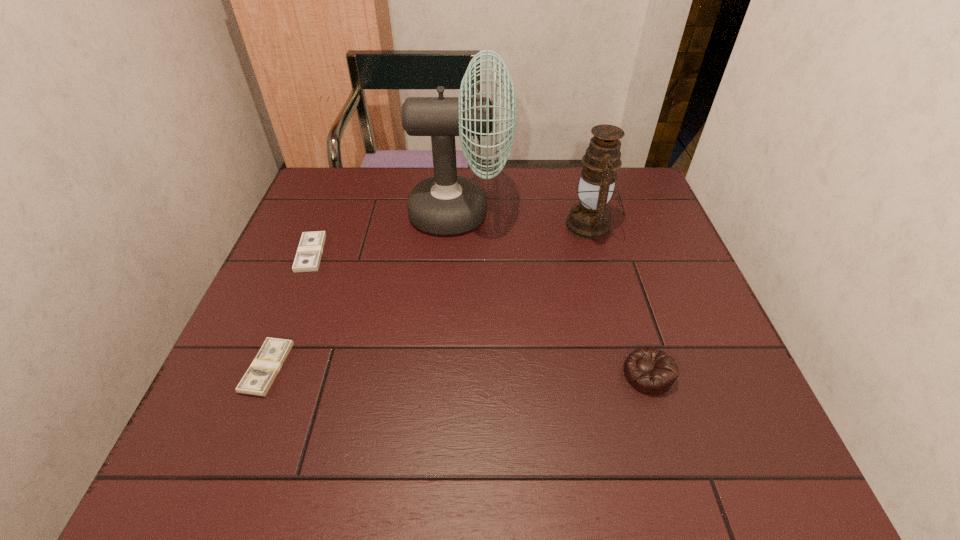
The image size is (960, 540). Find the location of `free point between the nearer dollar and the beanbag`. free point between the nearer dollar and the beanbag is located at coordinates (458, 370).

Locate an element on the screen. The height and width of the screenshot is (540, 960). vacant space that's between the beanbag and the farther dollar is located at coordinates (479, 314).

Locate an element on the screen. The height and width of the screenshot is (540, 960). vacant space that is in between the nearer dollar and the beanbag is located at coordinates (458, 370).

Choose which object is the second nearest neighbor to the oil lamp. Please provide its 2D coordinates. Your answer should be formatted as a tuple, i.e. [(x, y)], where the tuple contains the x and y coordinates of a point satisfying the conditions above.

[(651, 371)]

Identify which object is located as the second nearest to the fourth shortest object. Please provide its 2D coordinates. Your answer should be formatted as a tuple, i.e. [(x, y)], where the tuple contains the x and y coordinates of a point satisfying the conditions above.

[(651, 371)]

Identify the location of free spot that satisfies the following two spatial constraints: 1. on the front side of the beanbag; 2. on the left side of the nearer dollar. The width and height of the screenshot is (960, 540). (265, 374).

The image size is (960, 540). I want to click on free space in the image that satisfies the following two spatial constraints: 1. on the back side of the third shortest object; 2. in front of the third object from left to right where the airflow is directed, so click(597, 213).

Where is `free space that satisfies the following two spatial constraints: 1. in front of the third object from right to left where the airflow is directed; 2. on the back side of the fourth shortest object`? This screenshot has height=540, width=960. free space that satisfies the following two spatial constraints: 1. in front of the third object from right to left where the airflow is directed; 2. on the back side of the fourth shortest object is located at coordinates (459, 225).

Locate an element on the screen. The width and height of the screenshot is (960, 540). vacant space that satisfies the following two spatial constraints: 1. on the back side of the farther dollar; 2. on the left side of the oil lamp is located at coordinates (323, 225).

Where is `vacant area that satisfies the following two spatial constraints: 1. in front of the third object from left to right where the airflow is directed; 2. on the left side of the fourth shortest object`? Image resolution: width=960 pixels, height=540 pixels. vacant area that satisfies the following two spatial constraints: 1. in front of the third object from left to right where the airflow is directed; 2. on the left side of the fourth shortest object is located at coordinates (459, 225).